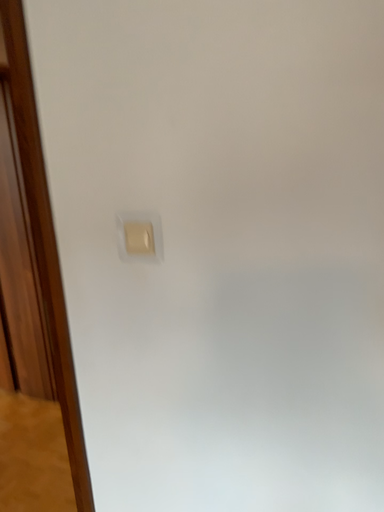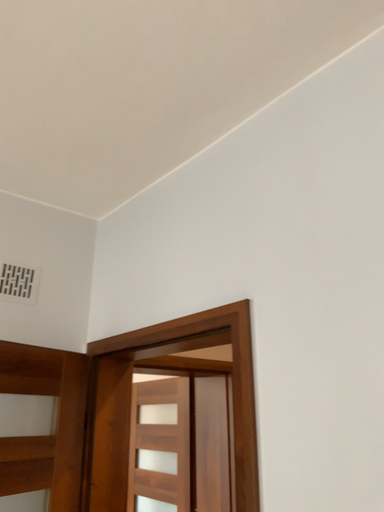
Question: Which way did the camera rotate in the video?

Choices:
 (A) rotated left
 (B) rotated right

Answer: (A)